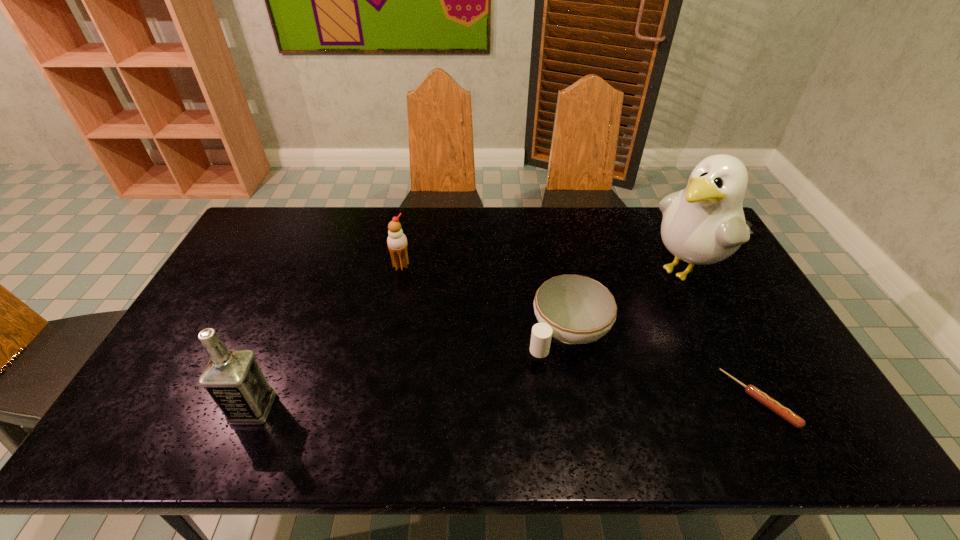
I want to click on free space on the desktop that is between the fourth shortest object and the sausage and is positioned on the side with the handle of the third farthest object, so click(x=489, y=404).

Where is `free spot on the desktop that is between the leftmost object and the shortest object and is positioned at the front with a straw on the third tallest object`? free spot on the desktop that is between the leftmost object and the shortest object and is positioned at the front with a straw on the third tallest object is located at coordinates (544, 403).

This screenshot has width=960, height=540. In order to click on vacant spot on the desktop that is between the second tallest object and the sausage and is positioned on the beak of the tallest object in this screenshot , I will do `click(480, 404)`.